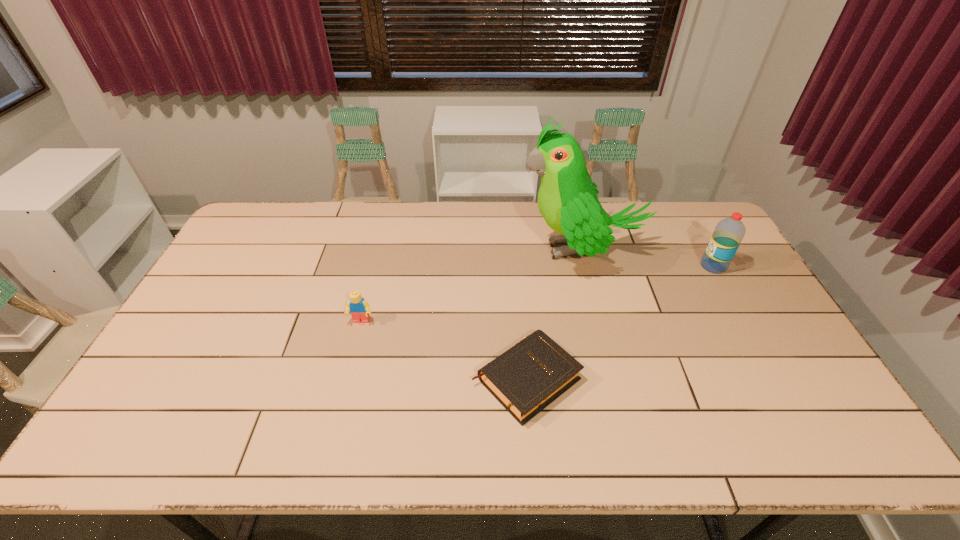
This screenshot has width=960, height=540. Find the location of `free space that satisfies the following two spatial constraints: 1. on the beak of the tallest object; 2. on the front-facing side of the second nearest object`. free space that satisfies the following two spatial constraints: 1. on the beak of the tallest object; 2. on the front-facing side of the second nearest object is located at coordinates (599, 321).

I want to click on free space that satisfies the following two spatial constraints: 1. on the front-facing side of the second nearest object; 2. on the right side of the nearest object, so click(347, 379).

Locate an element on the screen. The width and height of the screenshot is (960, 540). vacant area that satisfies the following two spatial constraints: 1. on the front-facing side of the shortest object; 2. on the left side of the leftmost object is located at coordinates (347, 379).

At what (x,y) coordinates should I click in order to perform the action: click on free space that satisfies the following two spatial constraints: 1. on the beak of the parakeet; 2. on the front side of the Bible. Please return your answer as a coordinate pair (x, y). The width and height of the screenshot is (960, 540). Looking at the image, I should click on (613, 379).

Find the location of a particular element. This screenshot has width=960, height=540. vacant space that satisfies the following two spatial constraints: 1. on the beak of the parakeet; 2. on the front-facing side of the Lego is located at coordinates (599, 321).